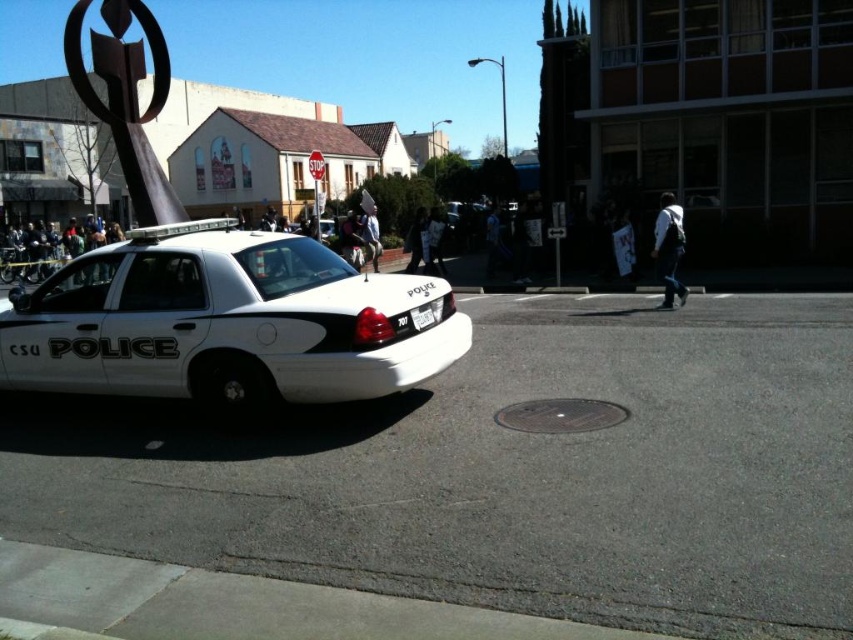
Question: Is white glossy police car at center further to the viewer compared to white plastic license plate at center?

Choices:
 (A) no
 (B) yes

Answer: (B)

Question: Can you confirm if white glossy police car at center is positioned to the right of white plastic license plate at center?

Choices:
 (A) yes
 (B) no

Answer: (B)

Question: Which point is farther to the camera?

Choices:
 (A) (416, 312)
 (B) (134, 332)

Answer: (B)

Question: Which object is closer to the camera taking this photo?

Choices:
 (A) white glossy police car at center
 (B) white plastic license plate at center

Answer: (B)

Question: Can you confirm if white glossy police car at center is positioned above white plastic license plate at center?

Choices:
 (A) no
 (B) yes

Answer: (B)